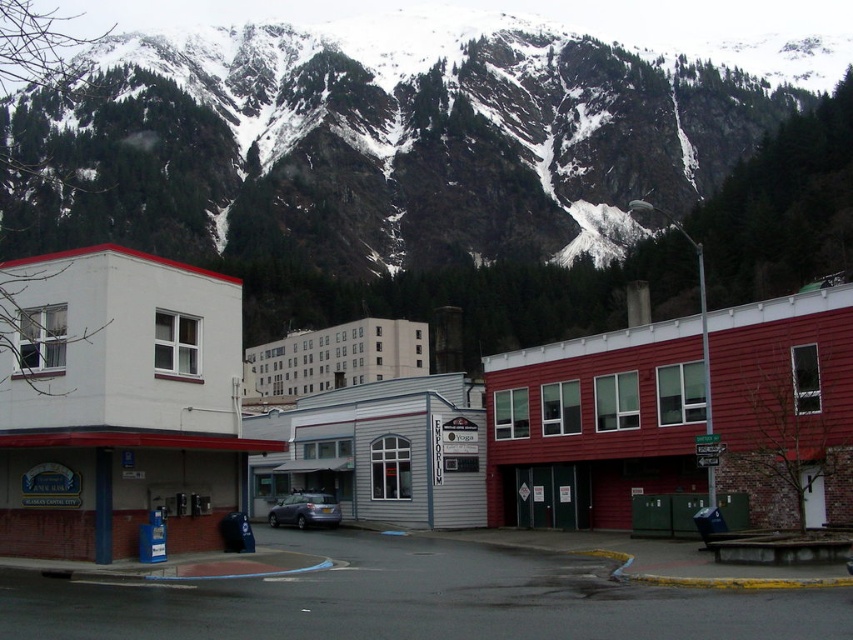
Question: Can you confirm if white matte building at center-left is smaller than metallic gray car at center?

Choices:
 (A) yes
 (B) no

Answer: (B)

Question: Which of the following is the closest to the observer?

Choices:
 (A) snowy rock at upper center
 (B) white matte building at center-left
 (C) metallic gray car at center

Answer: (B)

Question: Among these points, which one is farthest from the camera?

Choices:
 (A) (35, 285)
 (B) (303, 524)

Answer: (B)

Question: From the image, what is the correct spatial relationship of white matte building at center-left in relation to metallic gray car at center?

Choices:
 (A) right
 (B) left

Answer: (B)

Question: Is white matte building at center-left bigger than metallic gray car at center?

Choices:
 (A) yes
 (B) no

Answer: (A)

Question: Which point appears closest to the camera in this image?

Choices:
 (A) (769, 300)
 (B) (393, 36)
 (C) (334, 499)

Answer: (A)